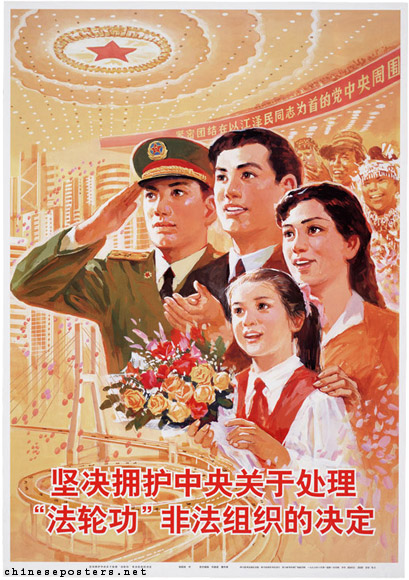
Locate an element on the screen. This screenshot has width=409, height=580. ceiling is located at coordinates (75, 34).